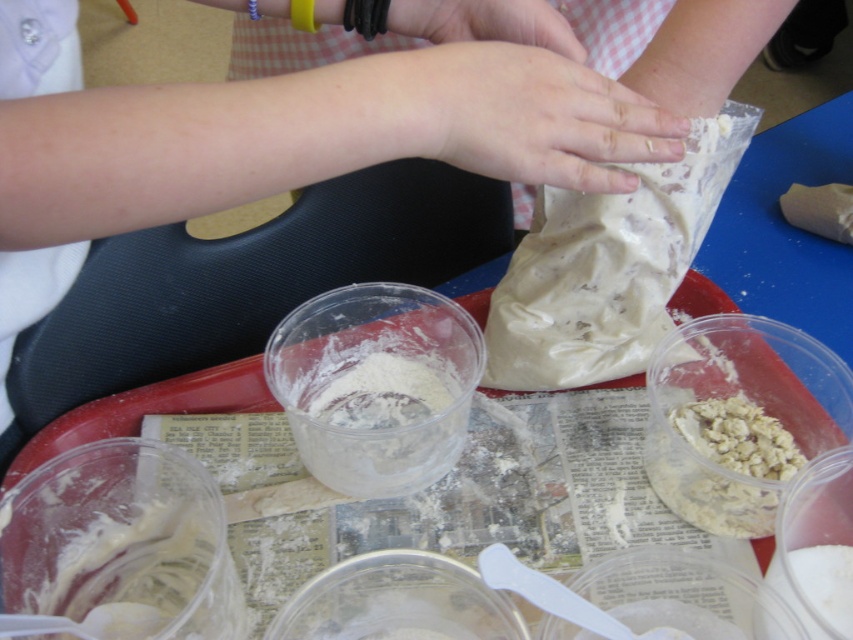
Between point (534, 326) and point (421, 397), which one is positioned behind?

Positioned behind is point (421, 397).

Which is in front, point (651, 288) or point (466, 340)?

Positioned in front is point (651, 288).

The image size is (853, 640). I want to click on white matte plastic bag at center, so click(608, 266).

How distant is transparent plastic bowl at center from clear plastic bowl at center?

The distance of transparent plastic bowl at center from clear plastic bowl at center is 3.34 inches.

Does transparent plastic bowl at center lie behind clear plastic bowl at center?

No, transparent plastic bowl at center is closer to the viewer.

Between point (407, 637) and point (672, 561), which one is positioned in front?

Point (672, 561)

Locate an element on the screen. Image resolution: width=853 pixels, height=640 pixels. transparent plastic bowl at center is located at coordinates (397, 602).

Measure the distance between white creamy batter at lower left and smooth skin hand at upper center.

white creamy batter at lower left and smooth skin hand at upper center are 14.61 inches apart from each other.

In the scene shown: Who is taller, white creamy batter at lower left or smooth skin hand at upper center?

Standing taller between the two is white creamy batter at lower left.

Between point (202, 515) and point (496, 29), which one is positioned behind?

Positioned behind is point (202, 515).

Where is `white creamy batter at lower left`? white creamy batter at lower left is located at coordinates (138, 577).